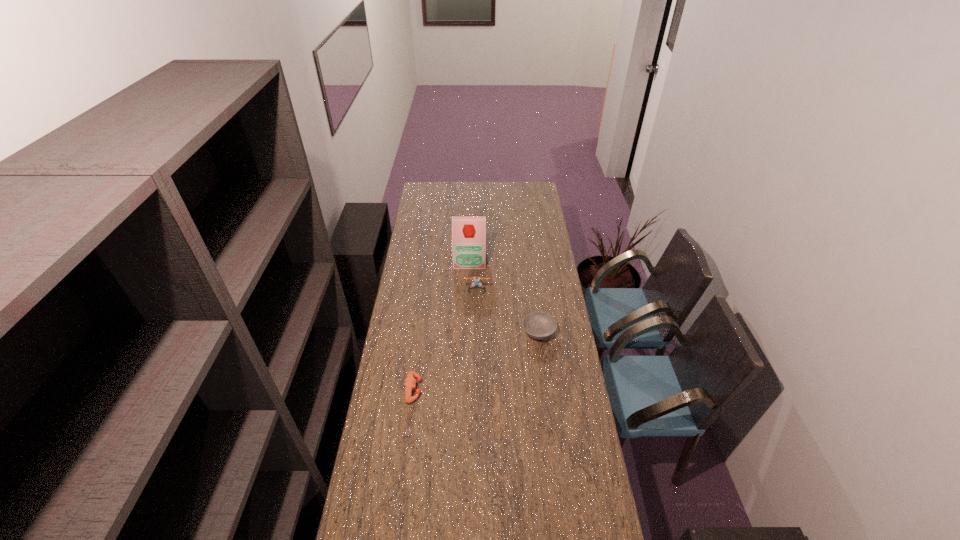
Find the location of a particular element. object that is the third closest to the second nearest object is located at coordinates (410, 382).

Locate an element on the screen. vacant point that satisfies the following two spatial constraints: 1. with the cap open on the farthest object; 2. with the gloves of the leftmost object facing forward is located at coordinates coord(466,389).

I want to click on free spot that satisfies the following two spatial constraints: 1. on the front side of the bowl; 2. with the gloves of the left puncher facing forward, so click(546, 389).

Find the location of `free space in the image that satisfies the following two spatial constraints: 1. on the front-facing side of the third farthest object; 2. on the left side of the right puncher`. free space in the image that satisfies the following two spatial constraints: 1. on the front-facing side of the third farthest object; 2. on the left side of the right puncher is located at coordinates (476, 333).

At what (x,y) coordinates should I click in order to perform the action: click on free space that satisfies the following two spatial constraints: 1. on the front-facing side of the farther puncher; 2. with the gloves of the leftmost object facing forward. Please return your answer as a coordinate pair (x, y). Looking at the image, I should click on (476, 389).

I want to click on vacant area in the image that satisfies the following two spatial constraints: 1. with the cap open on the soya milk; 2. with the gloves of the nearest object facing forward, so click(x=466, y=389).

Where is `free point that satisfies the following two spatial constraints: 1. with the cap open on the farthest object; 2. with the gloves of the nearest object facing forward`? free point that satisfies the following two spatial constraints: 1. with the cap open on the farthest object; 2. with the gloves of the nearest object facing forward is located at coordinates (466, 389).